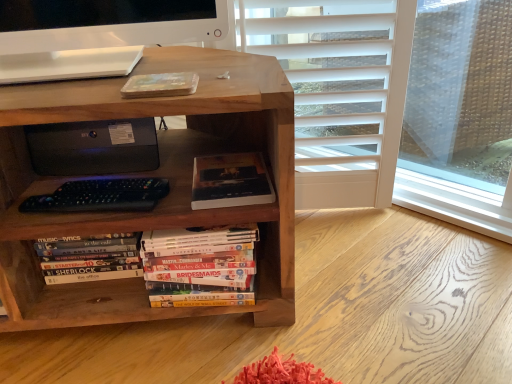
Question: Does point (82, 127) appear closer or farther from the camera than point (96, 278)?

Choices:
 (A) closer
 (B) farther

Answer: (A)

Question: In the image, is black matte printer at center on the left side or the right side of hardcover books at lower left, the 2th book when ordered from right to left?

Choices:
 (A) left
 (B) right

Answer: (B)

Question: Estimate the real-world distances between objects in this image. Which object is closer to the dark matte book at center, the first book positioned from the top?

Choices:
 (A) wooden bookcase at center
 (B) black matte printer at center
 (C) hardcover books at lower left, which is the first book in bottom-to-top order

Answer: (A)

Question: Estimate the real-world distances between objects in this image. Which object is closer to the black matte printer at center?

Choices:
 (A) wooden bookcase at center
 (B) dark matte book at center, placed as the second book when sorted from left to right
 (C) hardcover books at lower left, the 2th book when ordered from right to left

Answer: (C)